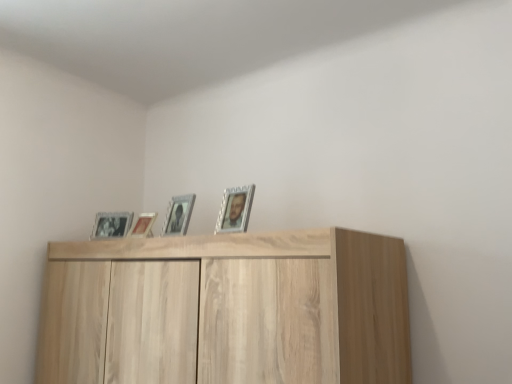
Question: Which direction should I rotate to look at matte silver picture frame at center, which is the third picture frame in front-to-back order?

Choices:
 (A) right
 (B) left

Answer: (B)

Question: Is the depth of matte silver picture frame at center, which is the third picture frame in front-to-back order, greater than that of silver metallic picture frame at upper center, which is counted as the 4th picture frame, starting from the left?

Choices:
 (A) no
 (B) yes

Answer: (B)

Question: From the image's perspective, is matte silver picture frame at center, which ranks as the second picture frame in back-to-front order, located above silver metallic picture frame at upper center, which is counted as the 4th picture frame, starting from the left?

Choices:
 (A) no
 (B) yes

Answer: (A)

Question: From the image's perspective, would you say matte silver picture frame at center, which ranks as the second picture frame in back-to-front order, is shown under silver metallic picture frame at upper center, which is the 1th picture frame from front to back?

Choices:
 (A) yes
 (B) no

Answer: (A)

Question: Can silver metallic picture frame at upper center, which is the 1th picture frame from front to back, be found inside matte silver picture frame at center, which is the third picture frame in front-to-back order?

Choices:
 (A) yes
 (B) no

Answer: (B)

Question: Considering the relative sizes of matte silver picture frame at center, arranged as the 3th picture frame when viewed from the right, and silver metallic picture frame at upper center, the fourth picture frame when ordered from back to front, in the image provided, is matte silver picture frame at center, arranged as the 3th picture frame when viewed from the right, taller than silver metallic picture frame at upper center, the fourth picture frame when ordered from back to front,?

Choices:
 (A) no
 (B) yes

Answer: (A)

Question: Can you confirm if matte silver picture frame at center, which ranks as the second picture frame in back-to-front order, is wider than silver metallic picture frame at upper center, the fourth picture frame when ordered from back to front?

Choices:
 (A) no
 (B) yes

Answer: (A)

Question: From the image's perspective, is light wood cupboard at upper center on top of metallic silver picture frame at center, arranged as the third picture frame when viewed from the left?

Choices:
 (A) no
 (B) yes

Answer: (A)

Question: Is light wood cupboard at upper center at the left side of metallic silver picture frame at center, the third picture frame viewed from the back?

Choices:
 (A) no
 (B) yes

Answer: (A)

Question: Does light wood cupboard at upper center have a lesser width compared to metallic silver picture frame at center, arranged as the third picture frame when viewed from the left?

Choices:
 (A) yes
 (B) no

Answer: (B)

Question: Could metallic silver picture frame at center, the 2th picture frame viewed from the right, be considered to be inside light wood cupboard at upper center?

Choices:
 (A) yes
 (B) no

Answer: (B)

Question: Is metallic silver picture frame at center, which is counted as the 2th picture frame, starting from the front, at the back of light wood cupboard at upper center?

Choices:
 (A) yes
 (B) no

Answer: (B)

Question: Considering the relative sizes of light wood cupboard at upper center and metallic silver picture frame at center, arranged as the third picture frame when viewed from the left, in the image provided, is light wood cupboard at upper center shorter than metallic silver picture frame at center, arranged as the third picture frame when viewed from the left,?

Choices:
 (A) no
 (B) yes

Answer: (A)

Question: From a real-world perspective, is metallic silver picture frame at center, arranged as the third picture frame when viewed from the left, over light wood cupboard at upper center?

Choices:
 (A) no
 (B) yes

Answer: (B)